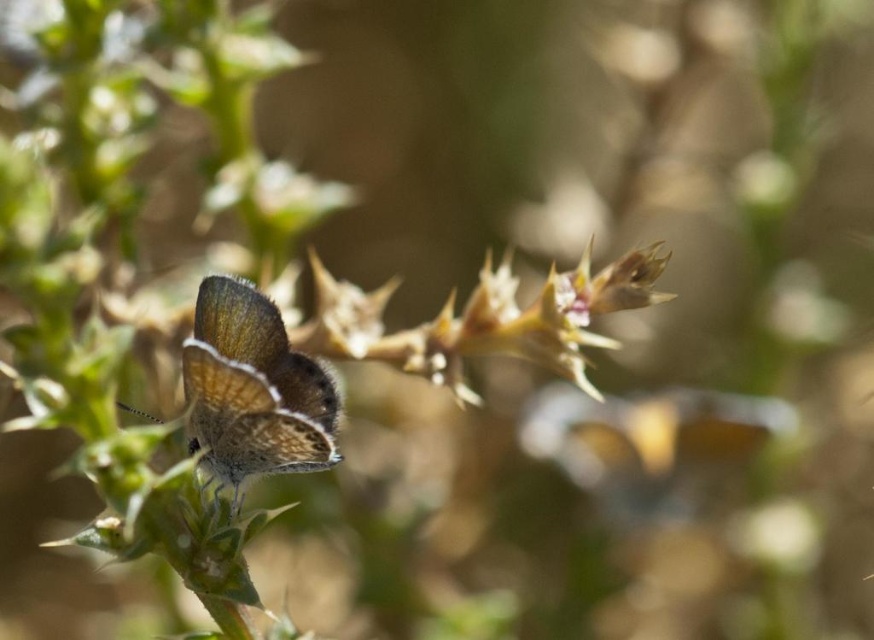
You are a photographer trying to capture a detailed shot of the satin brown butterfly at center and the brown spiny thorn at center. Given their sizes, which one would require you to get closer to focus properly?

The satin brown butterfly at center is smaller than the brown spiny thorn at center, so you would need to get closer to focus on the butterfly to capture its details properly.

You are a photographer trying to capture the brown spiny thorn at center and the satin brown butterfly at center in a single shot. Given that the butterfly is smaller than the thorn, will you need to adjust your camera to focus on both objects simultaneously?

The brown spiny thorn at center is wider than the satin brown butterfly at center. Since the butterfly is smaller, you may need to adjust your camera focus to ensure both are in focus, especially considering the shallow depth of field mentioned in the scene description.